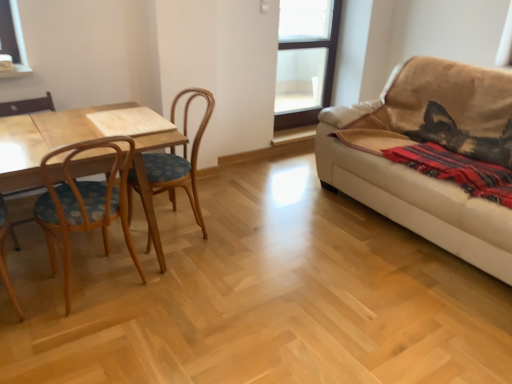
The width and height of the screenshot is (512, 384). What are the coordinates of `vacant space underneath woodenchair at left (from a real-world perspective)` in the screenshot? It's located at (185, 228).